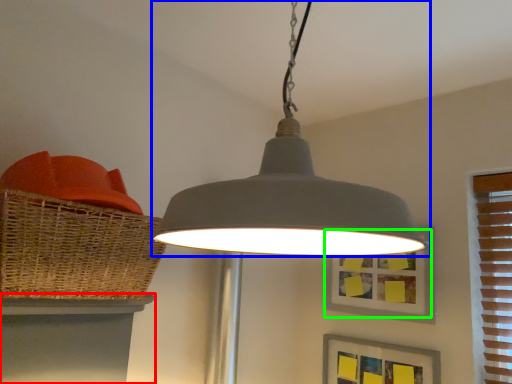
Question: Considering the real-world distances, which object is farthest from table (highlighted by a red box)? lamp (highlighted by a blue box) or picture frame (highlighted by a green box)?

Choices:
 (A) lamp
 (B) picture frame

Answer: (B)